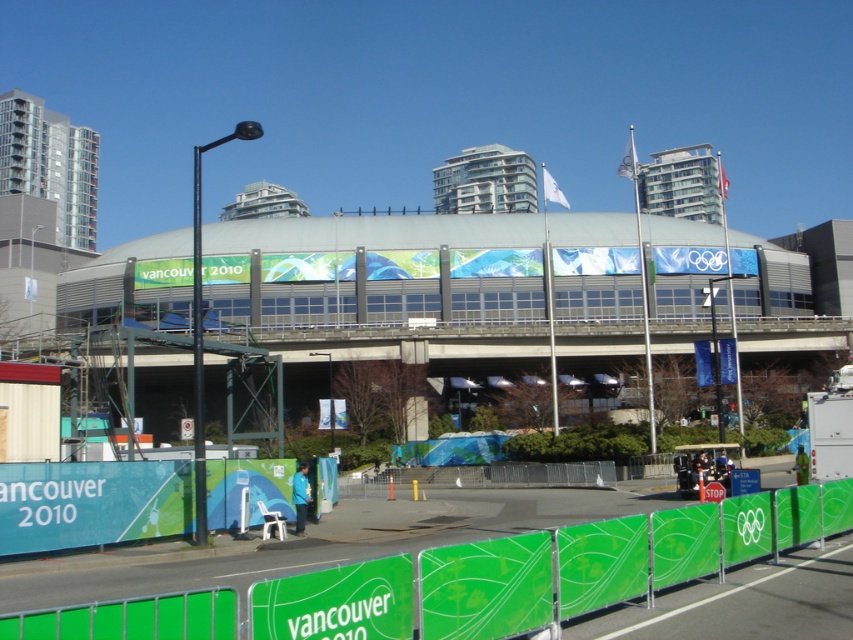
Which is more to the right, green fabric barrier at lower center or green fabric at lower center?

From the viewer's perspective, green fabric barrier at lower center appears more on the right side.

Can you confirm if green fabric barrier at lower center is positioned to the right of green fabric at lower center?

Indeed, green fabric barrier at lower center is positioned on the right side of green fabric at lower center.

At what (x,y) coordinates should I click in order to perform the action: click on green fabric barrier at lower center. Please return your answer as a coordinate pair (x, y). Image resolution: width=853 pixels, height=640 pixels. Looking at the image, I should click on (543, 570).